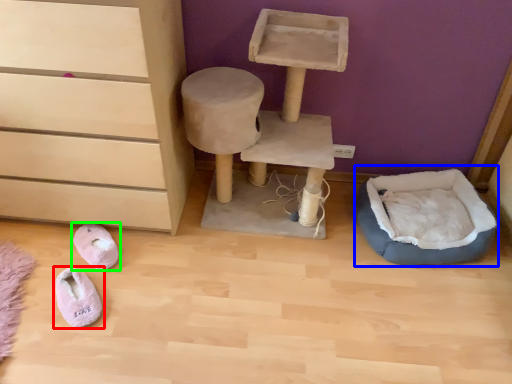
Question: Which is farther away from footwear (highlighted by a red box)? bean bag chair (highlighted by a blue box) or footwear (highlighted by a green box)?

Choices:
 (A) bean bag chair
 (B) footwear

Answer: (A)